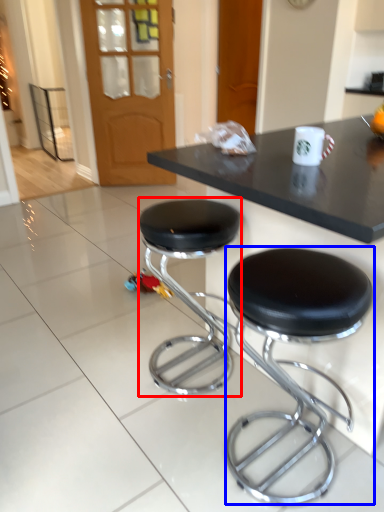
Question: Which point is closer to the camera, stool (highlighted by a red box) or stool (highlighted by a blue box)?

Choices:
 (A) stool
 (B) stool

Answer: (B)